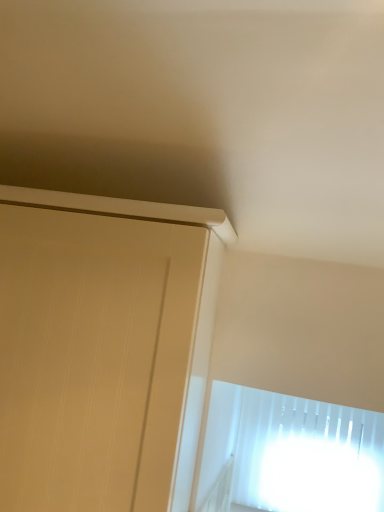
This screenshot has height=512, width=384. What do you see at coordinates (93, 357) in the screenshot? I see `matte beige screen door at upper left` at bounding box center [93, 357].

The height and width of the screenshot is (512, 384). What are the coordinates of `matte beige screen door at upper left` in the screenshot? It's located at (93, 357).

What are the coordinates of `matte beige screen door at upper left` in the screenshot? It's located at (93, 357).